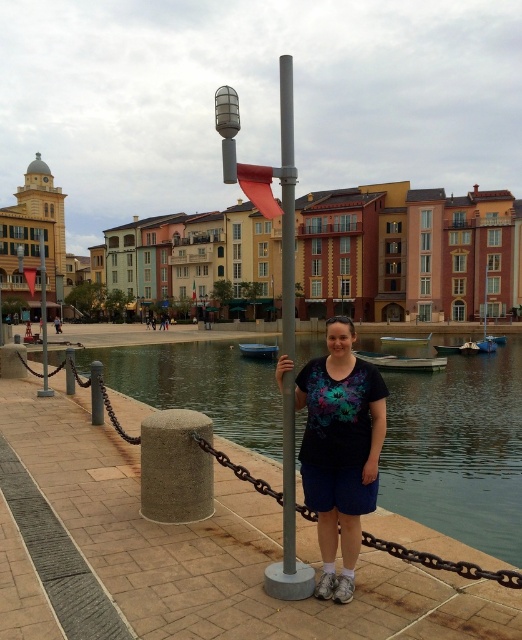
Question: Which object is closer to the camera taking this photo?

Choices:
 (A) metallic gray pole at center
 (B) silver metallic pole at center
 (C) black matte t-shirt at center

Answer: (A)

Question: Among these objects, which one is farthest from the camera?

Choices:
 (A) metallic gray pole at center
 (B) black matte t-shirt at center
 (C) silver metallic pole at center

Answer: (B)

Question: Is the position of smooth concrete waterway at center more distant than that of silver metallic pole at center?

Choices:
 (A) no
 (B) yes

Answer: (B)

Question: Is black matte t-shirt at center to the right of silver metallic pole at center from the viewer's perspective?

Choices:
 (A) yes
 (B) no

Answer: (B)

Question: Which of the following is the farthest from the observer?

Choices:
 (A) smooth concrete waterway at center
 (B) black matte t-shirt at center
 (C) metallic gray pole at center

Answer: (A)

Question: From the image, what is the correct spatial relationship of smooth concrete waterway at center in relation to metallic gray pole at center?

Choices:
 (A) left
 (B) right

Answer: (B)